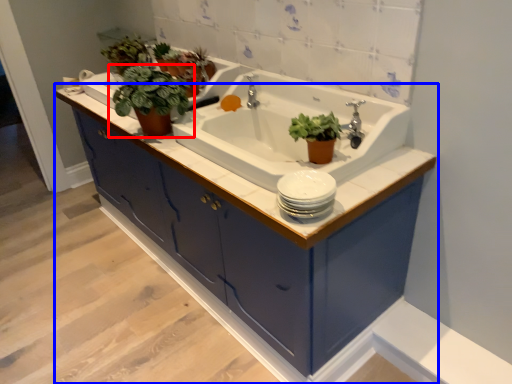
Question: Among these objects, which one is nearest to the camera, houseplant (highlighted by a red box) or bathroom cabinet (highlighted by a blue box)?

Choices:
 (A) houseplant
 (B) bathroom cabinet

Answer: (B)